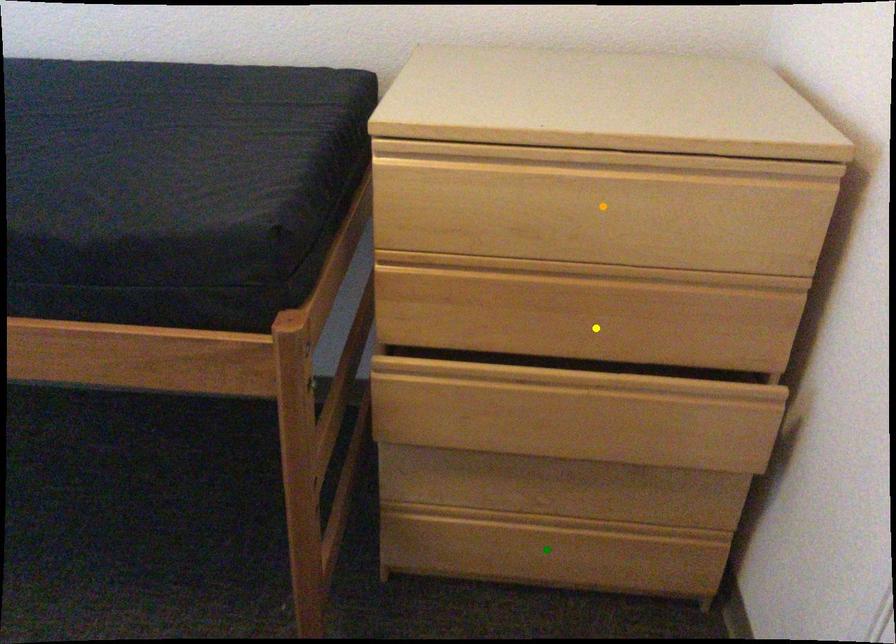
Order these from nearest to farthest:
- orange point
- green point
- yellow point

1. orange point
2. yellow point
3. green point